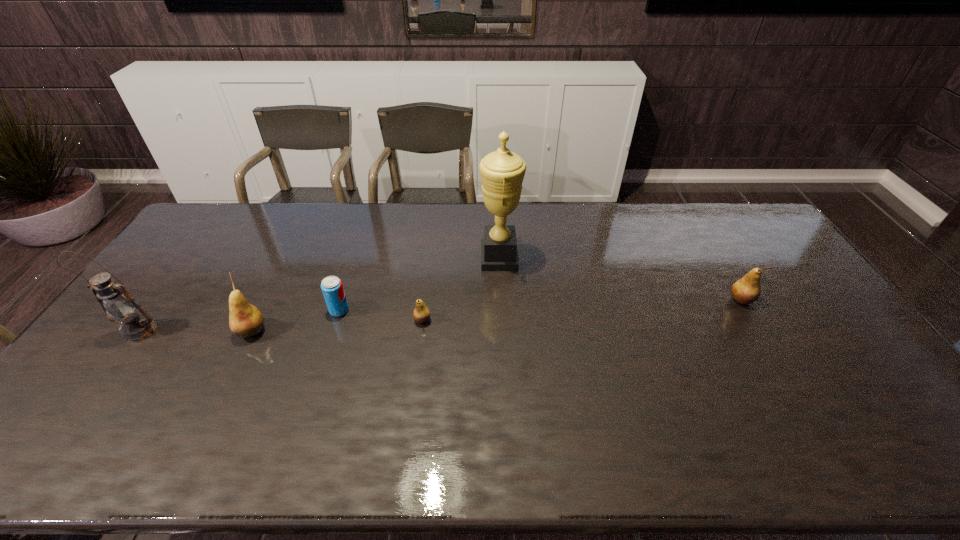
Where is `the leftmost pear`? This screenshot has width=960, height=540. the leftmost pear is located at coordinates (245, 320).

Image resolution: width=960 pixels, height=540 pixels. What are the coordinates of `the shortest pear` in the screenshot? It's located at (421, 314).

Identify the location of the third object from right to left. (421, 314).

The height and width of the screenshot is (540, 960). In order to click on the rightmost object in this screenshot , I will do `click(746, 290)`.

I want to click on the farthest pear, so click(x=746, y=290).

Where is `the second object from right to left`? The width and height of the screenshot is (960, 540). the second object from right to left is located at coordinates (502, 172).

At what (x,y) coordinates should I click in order to perform the action: click on the farthest object. Please return your answer as a coordinate pair (x, y). The image size is (960, 540). Looking at the image, I should click on (502, 172).

Where is `the second tallest object`? The height and width of the screenshot is (540, 960). the second tallest object is located at coordinates (120, 307).

Find the location of a particular element. This screenshot has width=960, height=540. the leftmost object is located at coordinates (120, 307).

Where is `soda can`? soda can is located at coordinates [x=332, y=288].